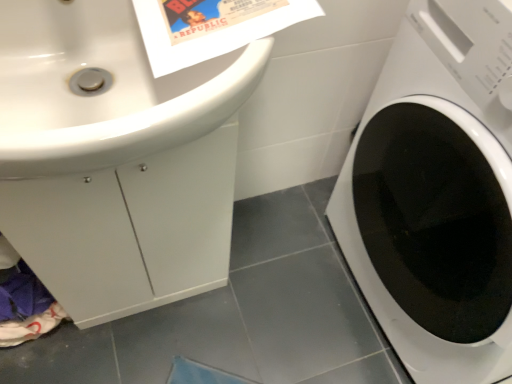
Question: Can you confirm if white glossy washing machine at right is bigger than white glossy sink at upper left?

Choices:
 (A) yes
 (B) no

Answer: (A)

Question: Is white glossy washing machine at right closer to the viewer compared to white glossy sink at upper left?

Choices:
 (A) yes
 (B) no

Answer: (B)

Question: Is white glossy washing machine at right completely or partially outside of white glossy sink at upper left?

Choices:
 (A) yes
 (B) no

Answer: (A)

Question: From the image's perspective, is white glossy washing machine at right located above white glossy sink at upper left?

Choices:
 (A) no
 (B) yes

Answer: (A)

Question: From the image's perspective, is white glossy washing machine at right located beneath white glossy sink at upper left?

Choices:
 (A) yes
 (B) no

Answer: (A)

Question: Is white glossy washing machine at right to the left of white glossy sink at upper left from the viewer's perspective?

Choices:
 (A) yes
 (B) no

Answer: (B)

Question: Can you confirm if white glossy sink at upper left is shorter than white glossy washing machine at right?

Choices:
 (A) no
 (B) yes

Answer: (B)

Question: Is white glossy sink at upper left behind white glossy washing machine at right?

Choices:
 (A) no
 (B) yes

Answer: (A)

Question: Does white glossy sink at upper left contain white glossy washing machine at right?

Choices:
 (A) no
 (B) yes

Answer: (A)

Question: From a real-world perspective, is white glossy sink at upper left under white glossy washing machine at right?

Choices:
 (A) no
 (B) yes

Answer: (A)

Question: Is white glossy sink at upper left bigger than white glossy washing machine at right?

Choices:
 (A) no
 (B) yes

Answer: (A)

Question: Does white glossy sink at upper left have a lesser width compared to white glossy washing machine at right?

Choices:
 (A) yes
 (B) no

Answer: (A)

Question: Looking at the image, does white glossy washing machine at right seem bigger or smaller compared to white glossy sink at upper left?

Choices:
 (A) small
 (B) big

Answer: (B)